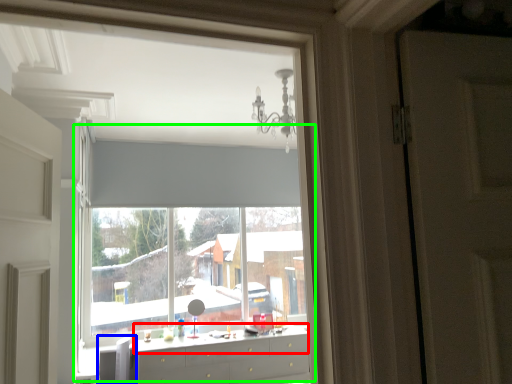
Question: Which object is the farthest from counter top (highlighted by a red box)? Choose among these: swivel chair (highlighted by a blue box) or bay window (highlighted by a green box).

Choices:
 (A) swivel chair
 (B) bay window

Answer: (B)